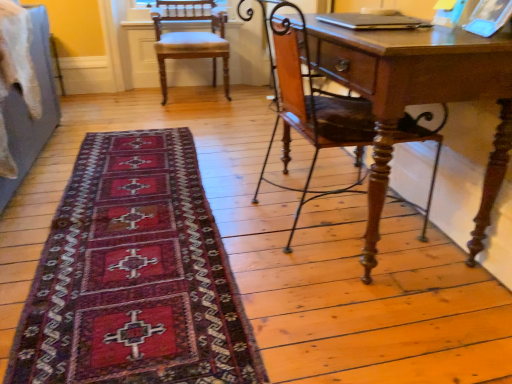
This screenshot has height=384, width=512. I want to click on free location to the right of dark red woven rug at lower left, so click(x=310, y=222).